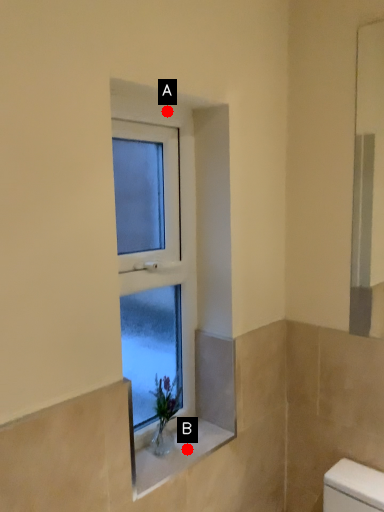
Question: Two points are circled on the image, labeled by A and B beside each circle. Which point is closer to the camera taking this photo?

Choices:
 (A) A is closer
 (B) B is closer

Answer: (A)